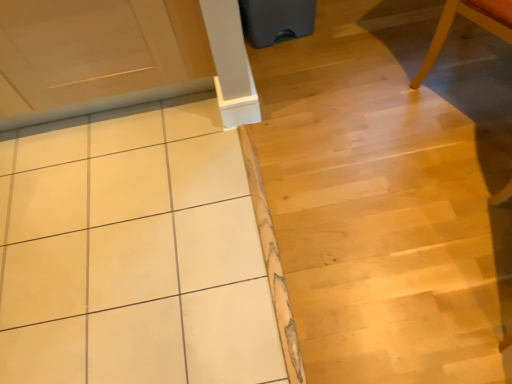
Question: Is white tile at upper left inside or outside of light wood chair at upper right?

Choices:
 (A) inside
 (B) outside

Answer: (B)

Question: Visually, is white tile at upper left positioned to the left or to the right of light wood chair at upper right?

Choices:
 (A) right
 (B) left

Answer: (B)

Question: Estimate the real-world distances between objects in this image. Which object is closer to the white tile at upper left?

Choices:
 (A) white glossy tile at center
 (B) light wood chair at upper right

Answer: (B)

Question: Which object is the farthest from the white glossy tile at center?

Choices:
 (A) white tile at upper left
 (B) light wood chair at upper right

Answer: (B)